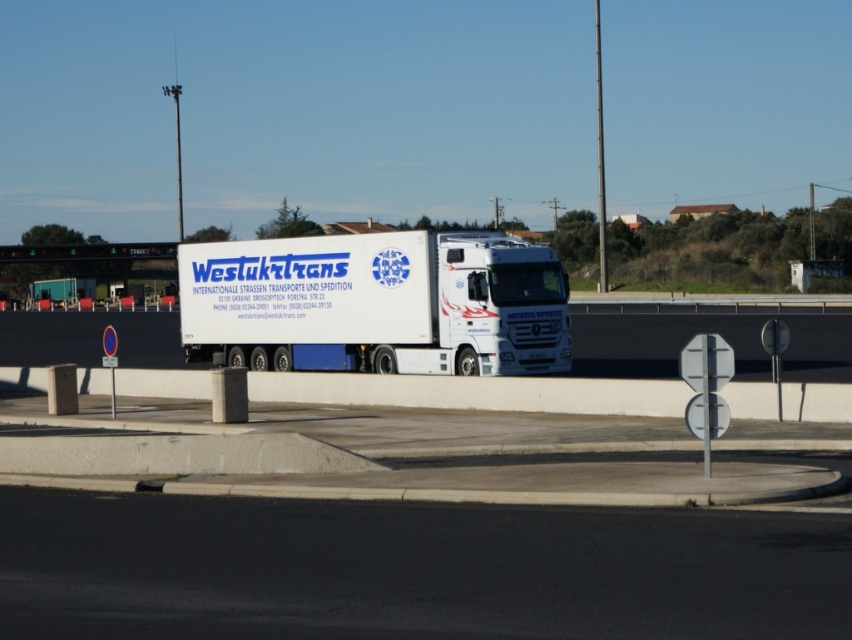
Which is more to the right, white glossy truck at center or green electronic sign at upper center?

white glossy truck at center

Measure the distance between white glossy truck at center and camera.

white glossy truck at center is 34.96 meters away from camera.

Describe the element at coordinates (660, 342) in the screenshot. The image size is (852, 640). I see `white glossy truck at center` at that location.

The width and height of the screenshot is (852, 640). What are the coordinates of `white glossy truck at center` in the screenshot? It's located at (660, 342).

Who is shorter, white glossy trailer truck at center or white glossy truck at center?

With less height is white glossy truck at center.

Who is more distant from viewer, (x=188, y=310) or (x=832, y=339)?

The point (x=832, y=339) is more distant.

You are a GUI agent. You are given a task and a screenshot of the screen. Output one action in this format:
    pyautogui.click(x=<x>, y=<y>)
    Task: Click on the white glossy trailer truck at center
    This screenshot has width=852, height=640.
    Given the screenshot: What is the action you would take?
    pyautogui.click(x=376, y=304)

Between point (452, 264) and point (148, 246), which one is positioned in front?

Positioned in front is point (452, 264).

Who is lower down, white glossy trailer truck at center or green electronic sign at upper center?

Positioned lower is white glossy trailer truck at center.

Does point (471, 321) lie in front of point (84, 250)?

That is True.

Image resolution: width=852 pixels, height=640 pixels. What are the coordinates of `white glossy trailer truck at center` in the screenshot? It's located at (376, 304).